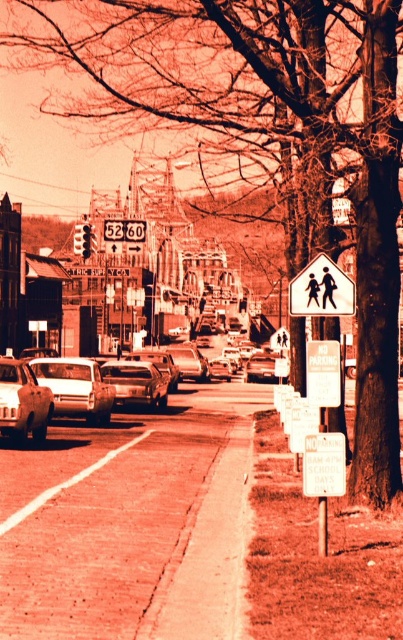
Which is below, matte white car at center or matte silver sedan at center-left?

matte silver sedan at center-left is lower down.

Which is in front, point (58, 364) or point (22, 365)?

Point (22, 365) is in front.

Where is `matte white car at center`? The width and height of the screenshot is (403, 640). matte white car at center is located at coordinates (76, 387).

Can you confirm if matte white car at center is smaller than white plastic pedestrian crossing sign at center?

No.

Between point (35, 364) and point (299, 308), which one is positioned behind?

The point (35, 364) is more distant.

You are a GUI agent. You are given a task and a screenshot of the screen. Output one action in this format:
    pyautogui.click(x=<x>, y=<y>)
    Task: Click on the matte white car at center
    The width and height of the screenshot is (403, 640).
    Given the screenshot: What is the action you would take?
    pyautogui.click(x=76, y=387)

Can you confirm if matte white car at center is positioned to the left of matte silver sedan at center?

Indeed, matte white car at center is positioned on the left side of matte silver sedan at center.

Does matte white car at center come behind matte silver sedan at center?

No, it is not.

What do you see at coordinates (76, 387) in the screenshot? I see `matte white car at center` at bounding box center [76, 387].

Identify the location of matte white car at center. (76, 387).